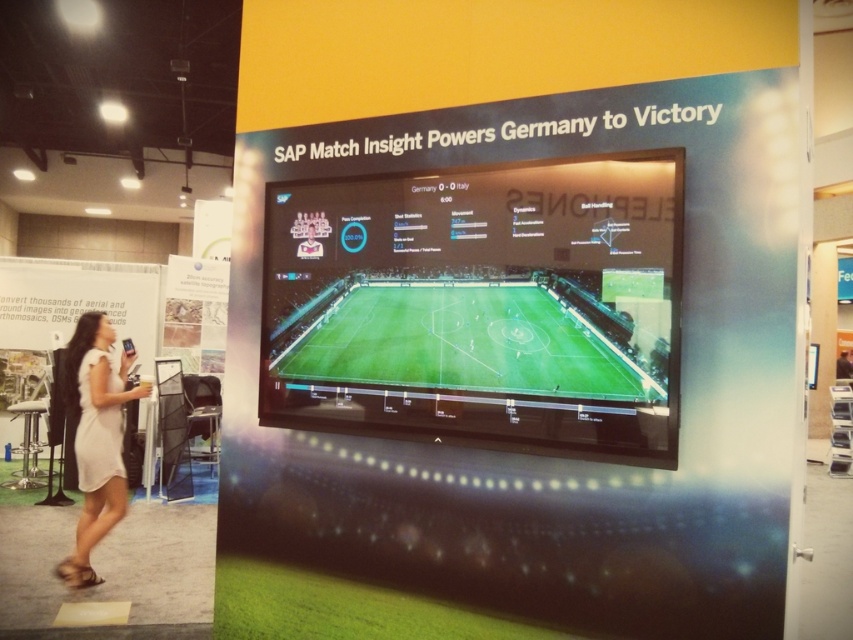
You are standing in front of the large screen displaying the soccer match between Germany and Italy. You notice two points on the screen at coordinates point (x=676, y=280) and point (x=91, y=333). Which point appears closer to your eyes?

Point (x=676, y=280) is closer to the camera than point (x=91, y=333), so it appears closer to your eyes.

You are a photographer at the exhibition. You want to take a photo of the white matte dress at lower left without the green artificial turf at center appearing in the background. Is this possible?

The green artificial turf at center is in front of the white matte dress at lower left, so the dress is behind the turf. Therefore, it is not possible to take a photo of the white matte dress at lower left without the green artificial turf at center appearing in the background.

You are a photographer at the exhibition. You need to take a photo of the white matte dress at lower left without the green artificial turf at center appearing in the frame. Is this possible based on their positions?

The green artificial turf at center is located above the white matte dress at lower left, so if you position your camera to focus on the lower area where the white matte dress at lower left is placed, you can avoid including the green artificial turf at center in the photo.